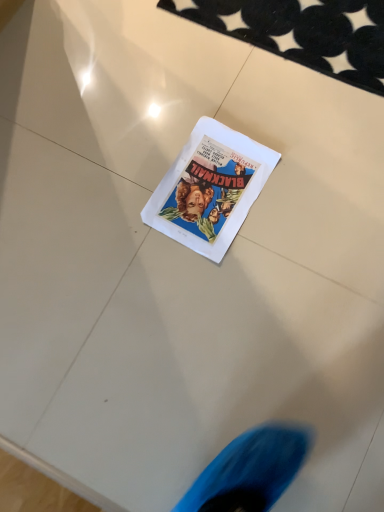
Locate an element on the screen. The image size is (384, 512). blank space above white paper flyer at center (from a real-world perspective) is located at coordinates (209, 186).